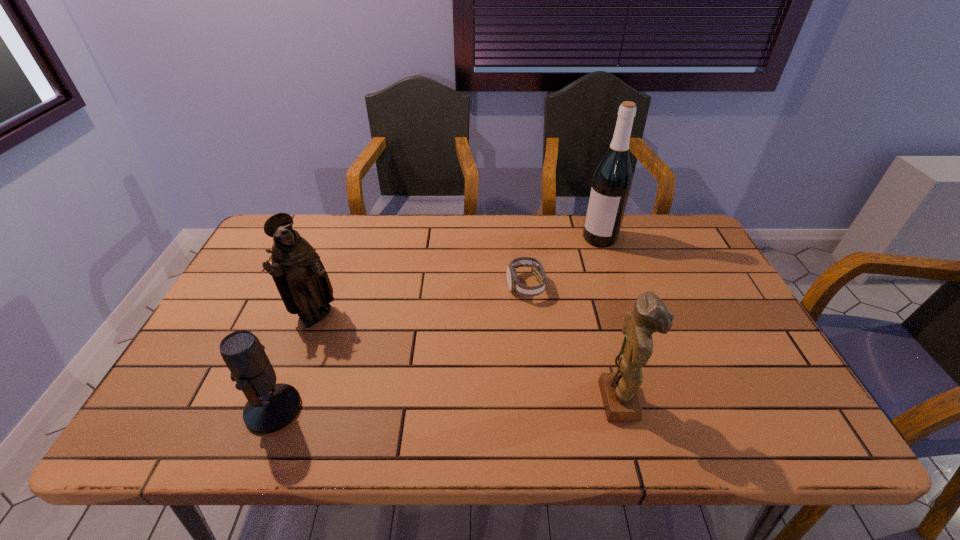
Identify the location of free space located 0.100m on the face of the fourth nearest object. This screenshot has width=960, height=540. (501, 324).

At what (x,y) coordinates should I click in order to perform the action: click on vacant region located 0.050m on the face of the fourth nearest object. Please return your answer as a coordinate pair (x, y). Looking at the image, I should click on pos(510,312).

Image resolution: width=960 pixels, height=540 pixels. In order to click on vacant space located 0.260m on the front-facing side of the left figurine in this screenshot , I will do `click(416, 363)`.

Locate an element on the screen. The width and height of the screenshot is (960, 540). blank area located 0.100m on the front-facing side of the left figurine is located at coordinates [365, 338].

Find the location of a particular element. Image resolution: width=960 pixels, height=540 pixels. free space located on the front-facing side of the left figurine is located at coordinates (359, 335).

In order to click on free location located 0.060m on the label of the wine bottle in this screenshot , I will do `click(584, 256)`.

This screenshot has height=540, width=960. I want to click on vacant space located 0.140m on the label of the wine bottle, so click(571, 270).

Find the location of a particular element. free space located 0.180m on the label of the wine bottle is located at coordinates (564, 277).

Locate an element on the screen. Image resolution: width=960 pixels, height=540 pixels. object that is at the far edge is located at coordinates (612, 180).

Locate an element on the screen. microphone positioned at the near edge is located at coordinates (270, 407).